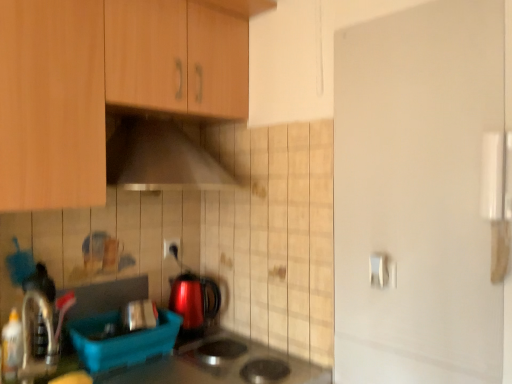
Question: In terms of width, does metallic silver toaster at lower center, which is the second appliance in front-to-back order, look wider or thinner when compared to blue plastic container at lower left, the second appliance when ordered from back to front?

Choices:
 (A) wide
 (B) thin

Answer: (B)

Question: In the image, is metallic silver toaster at lower center, the first appliance from the back, positioned in front of or behind blue plastic container at lower left, which ranks as the 1th appliance in front-to-back order?

Choices:
 (A) front
 (B) behind

Answer: (B)

Question: Which of these objects is positioned closest to the metallic silver toaster at lower center, the first appliance from the back?

Choices:
 (A) white plastic electric outlet at center
 (B) white glossy door handle at upper right
 (C) metallic silver range hood at upper center
 (D) wooden cabinet at upper left
 (E) blue plastic container at lower left, which ranks as the 1th appliance in front-to-back order

Answer: (E)

Question: Which object is positioned closest to the blue plastic container at lower left, the second appliance when ordered from back to front?

Choices:
 (A) wooden cabinet at upper left
 (B) metallic silver toaster at lower center, the first appliance from the back
 (C) metallic silver range hood at upper center
 (D) translucent plastic bottle at lower left
 (E) white plastic electric outlet at center

Answer: (B)